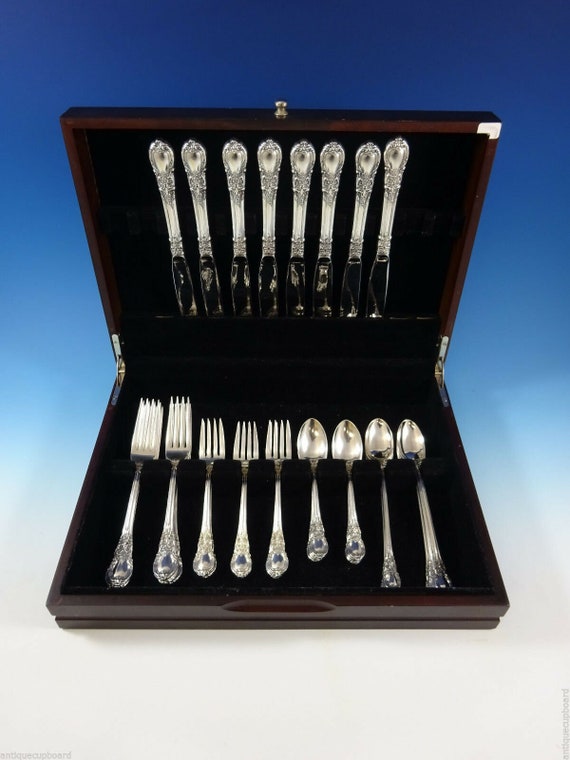
You are a GUI agent. You are given a task and a screenshot of the screen. Output one action in this format:
    pyautogui.click(x=<x>, y=<y>)
    Task: Click on the spoons
    This screenshot has height=760, width=570.
    Given the screenshot: What is the action you would take?
    pyautogui.click(x=408, y=448), pyautogui.click(x=349, y=448), pyautogui.click(x=305, y=451), pyautogui.click(x=378, y=445)